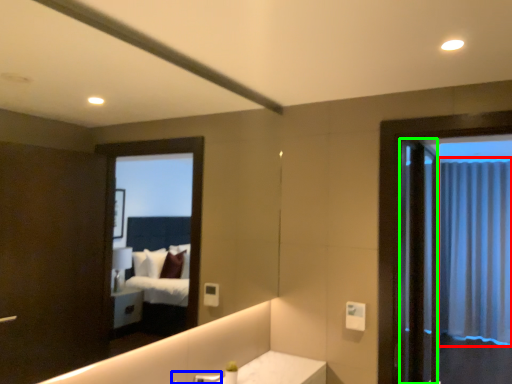
Question: Which object is positioned farthest from curtain (highlighted by a red box)? Select from faucet (highlighted by a blue box) and screen door (highlighted by a green box).

Choices:
 (A) faucet
 (B) screen door

Answer: (A)